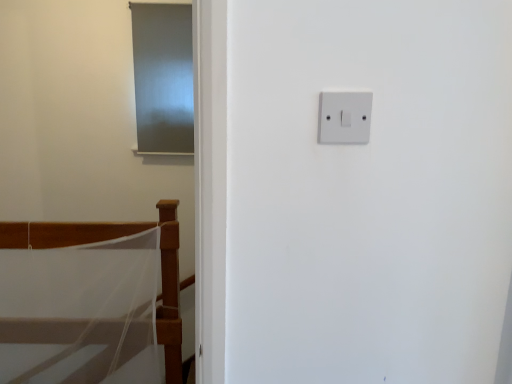
Question: Relative to white mesh bed at lower left, is matte gray screen door at upper left in front or behind?

Choices:
 (A) behind
 (B) front

Answer: (A)

Question: Is matte gray screen door at upper left spatially inside white mesh bed at lower left, or outside of it?

Choices:
 (A) outside
 (B) inside

Answer: (A)

Question: Which is nearer to the white plastic light switch at upper right?

Choices:
 (A) white mesh bed at lower left
 (B) matte gray screen door at upper left

Answer: (A)

Question: Which object is the closest to the white plastic light switch at upper right?

Choices:
 (A) white mesh bed at lower left
 (B) matte gray screen door at upper left

Answer: (A)